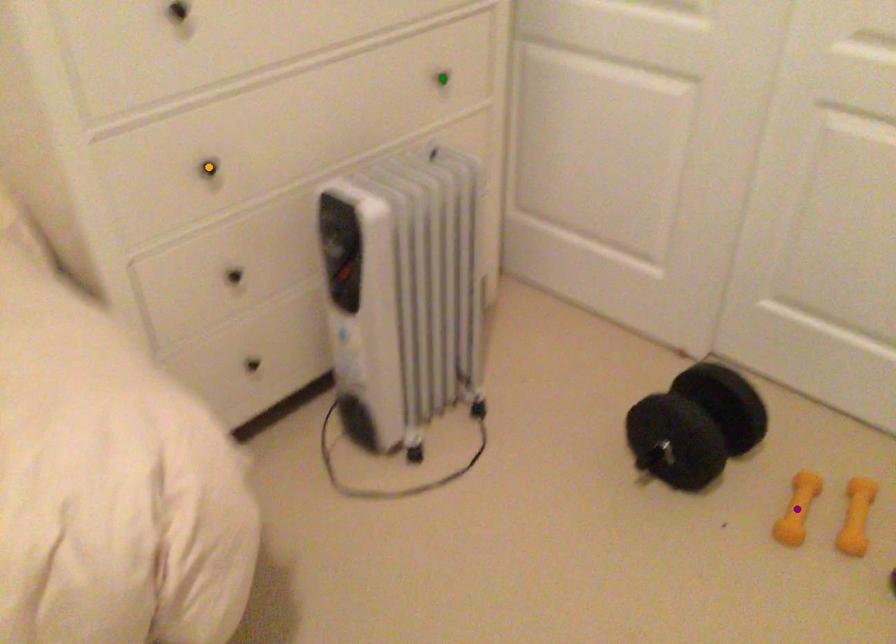
Order these from nearest to farthest:
- purple point
- green point
- orange point

orange point < purple point < green point